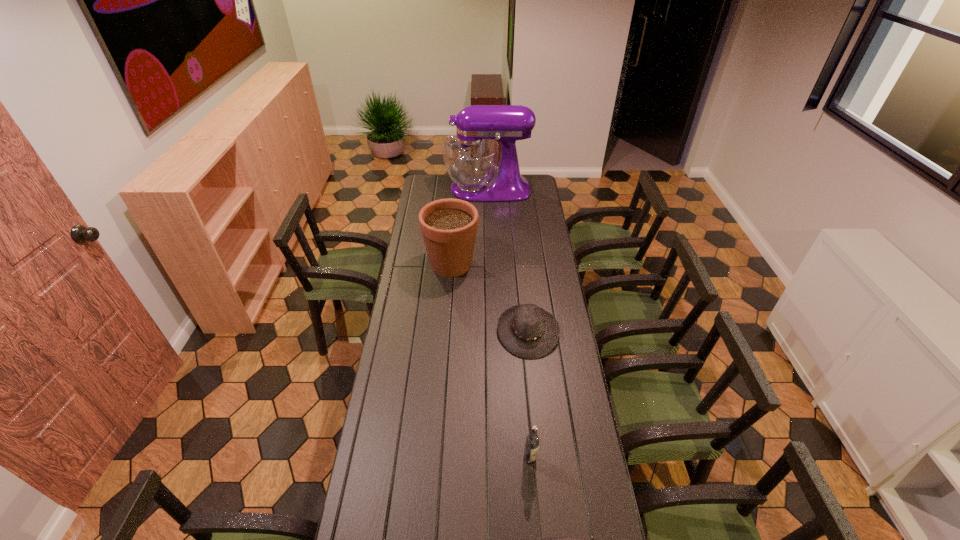
The height and width of the screenshot is (540, 960). I want to click on vacant area located 0.160m on the label of the vodka, so click(535, 518).

Find the location of `free space located 0.200m on the front-facing side of the second shortest object`. free space located 0.200m on the front-facing side of the second shortest object is located at coordinates click(x=450, y=331).

This screenshot has height=540, width=960. I want to click on vacant space situated 0.210m on the front-facing side of the second shortest object, so coord(447,331).

Locate an element on the screen. free space located 0.390m on the front-facing side of the second shortest object is located at coordinates (405, 331).

Locate an element on the screen. object at the far edge is located at coordinates (470, 157).

At what (x,y) coordinates should I click in order to perform the action: click on mixer present at the left edge. Please return your answer as a coordinate pair (x, y). The height and width of the screenshot is (540, 960). Looking at the image, I should click on (470, 157).

At what (x,y) coordinates should I click in order to perform the action: click on flowerpot that is at the left edge. Please return your answer as a coordinate pair (x, y). The height and width of the screenshot is (540, 960). Looking at the image, I should click on (449, 226).

The height and width of the screenshot is (540, 960). I want to click on mixer located in the right edge section of the desktop, so click(470, 157).

What are the coordinates of `hat at the right edge` in the screenshot? It's located at (527, 331).

Locate an element on the screen. Image resolution: width=960 pixels, height=540 pixels. object that is at the far left corner is located at coordinates (470, 157).